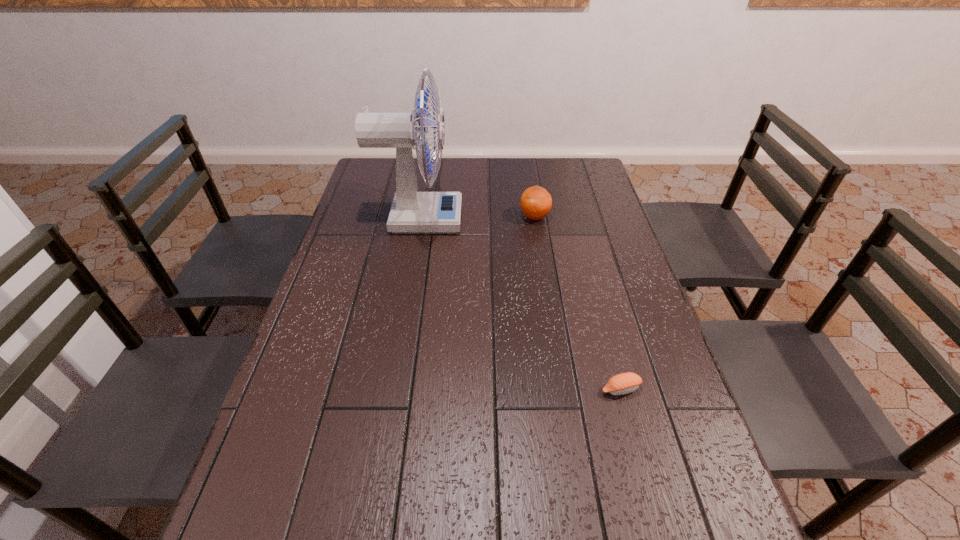
This screenshot has height=540, width=960. Find the location of `vacant space that satisfies the following two spatial constraints: 1. on the front-facing side of the leftmost object; 2. on the right side of the nearest object`. vacant space that satisfies the following two spatial constraints: 1. on the front-facing side of the leftmost object; 2. on the right side of the nearest object is located at coordinates (390, 389).